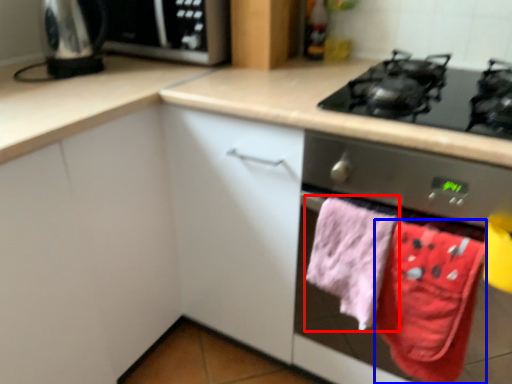
Question: Which object appears farthest to the camera in this image, beach towel (highlighted by a red box) or beach towel (highlighted by a blue box)?

Choices:
 (A) beach towel
 (B) beach towel

Answer: (A)